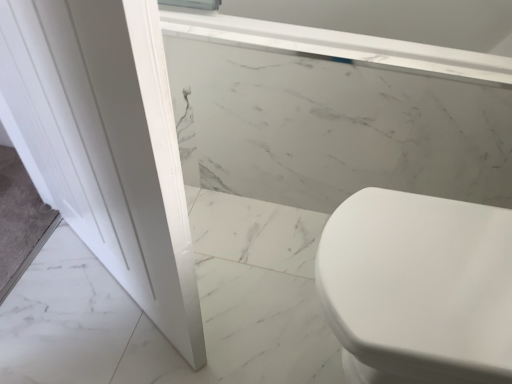
This screenshot has width=512, height=384. Identify the location of blank space situated above white marble bathtub at upper center (from a real-world perspective). (328, 54).